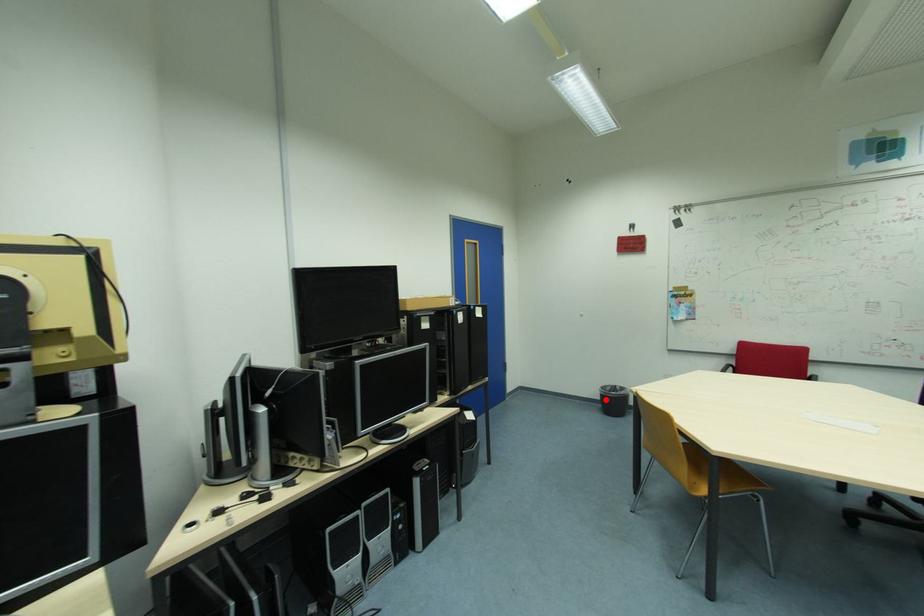
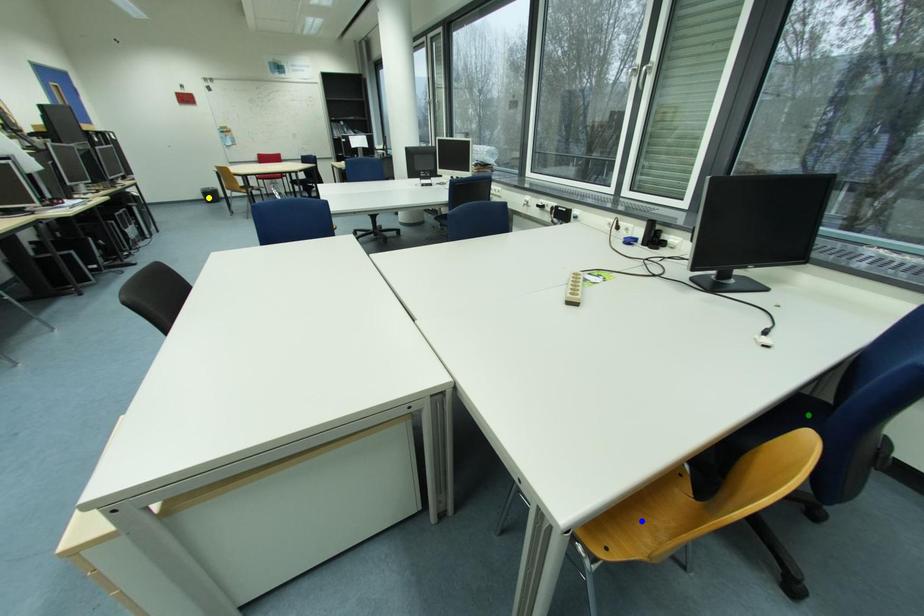
Question: I am providing you with two images of the same scene from different viewpoints. A red point is marked on the first image. You are given multiple points on the second image. Which spot in image 2 lines up with the point in image 1?

Choices:
 (A) green point
 (B) blue point
 (C) yellow point

Answer: (C)